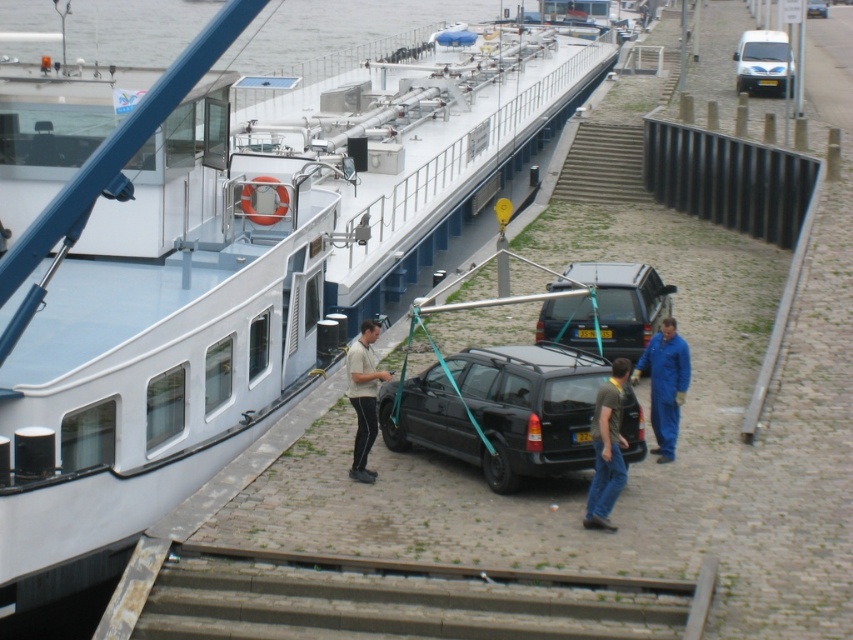
Question: Can you confirm if black matte car at center is thinner than metallic blue car at center?

Choices:
 (A) no
 (B) yes

Answer: (B)

Question: Can you confirm if blue coveralls at lower right is positioned above white cotton shirt at center?

Choices:
 (A) no
 (B) yes

Answer: (B)

Question: Which point appears closest to the camera in this image?

Choices:
 (A) (825, 13)
 (B) (608, 412)
 (C) (624, 332)
 (D) (364, 362)

Answer: (B)

Question: Observing the image, what is the correct spatial positioning of white glossy boat at upper left in reference to matte black suv at center?

Choices:
 (A) left
 (B) right

Answer: (A)

Question: Among these objects, which one is farthest from the camera?

Choices:
 (A) white glossy boat at upper left
 (B) metallic blue car at center
 (C) white cotton shirt at center

Answer: (B)

Question: Which point appears farthest from the camera in this image?

Choices:
 (A) (669, 376)
 (B) (805, 1)
 (C) (607, 304)

Answer: (B)